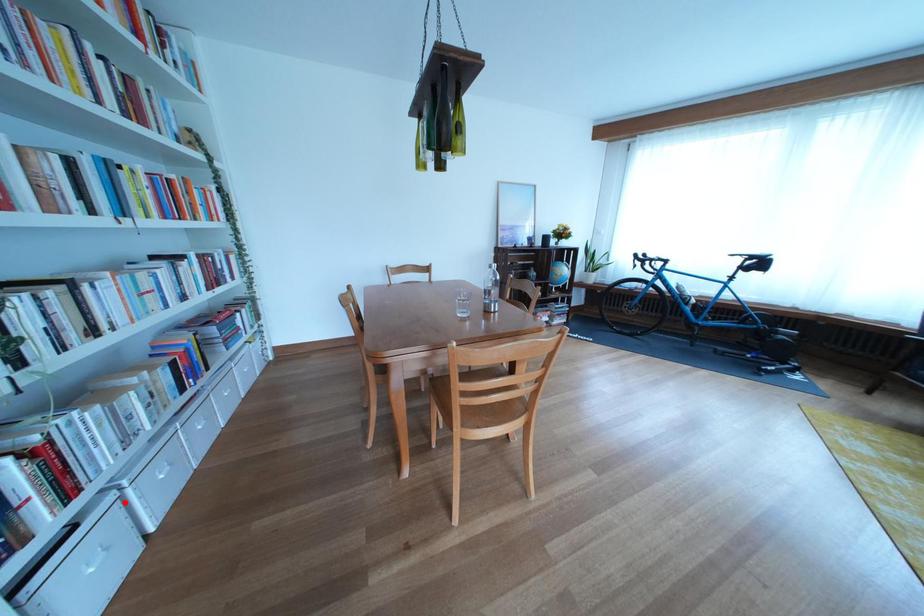
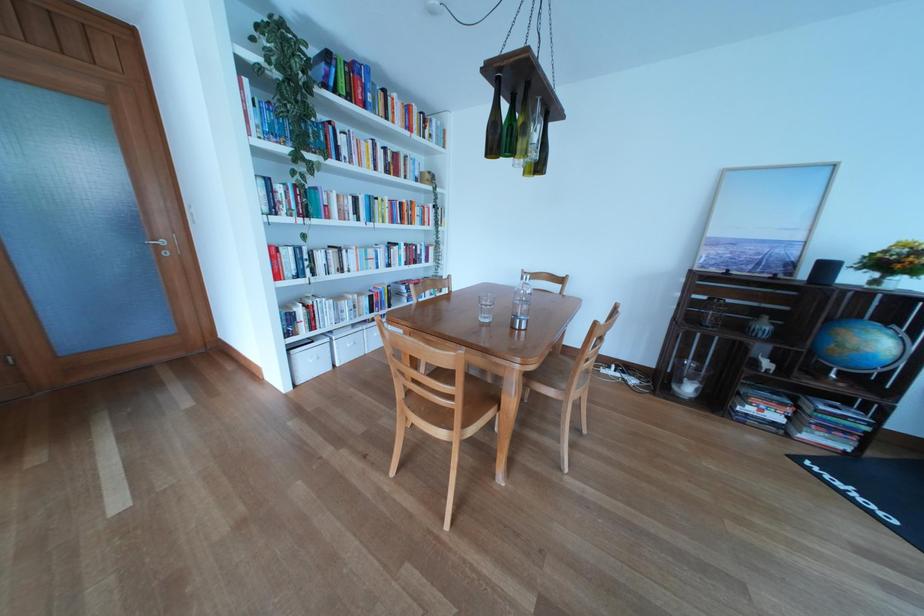
Where in the second image is the point corresponding to the highlighted location from the first image?

(341, 345)